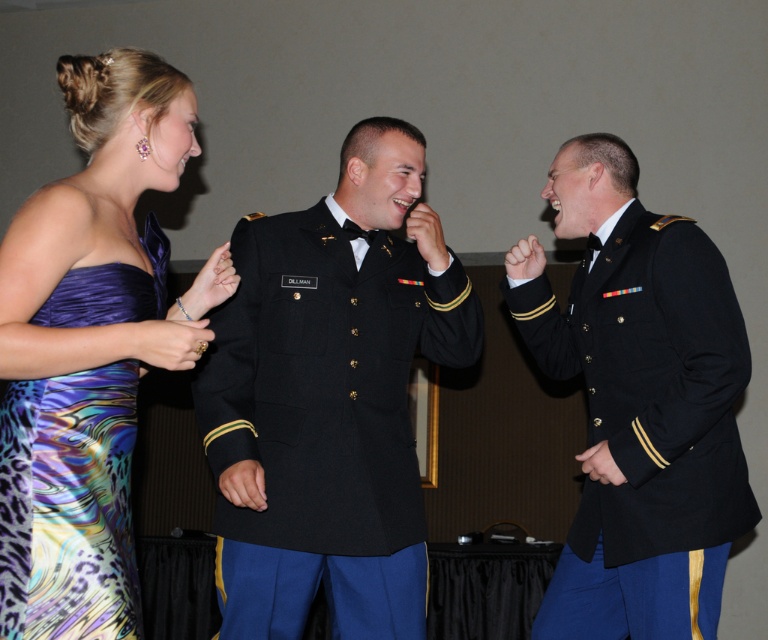
Question: Does black wool military uniform at center appear on the right side of matte black uniform at center?

Choices:
 (A) yes
 (B) no

Answer: (B)

Question: Among these points, which one is farthest from the camera?

Choices:
 (A) (376, 525)
 (B) (51, 477)

Answer: (A)

Question: Can you confirm if black wool military uniform at center is positioned to the right of matte black uniform at center?

Choices:
 (A) yes
 (B) no

Answer: (B)

Question: Is black wool military uniform at center positioned at the back of multicolored satin dress at left?

Choices:
 (A) no
 (B) yes

Answer: (B)

Question: Which of the following is the farthest from the observer?

Choices:
 (A) (x=0, y=548)
 (B) (x=164, y=337)

Answer: (B)

Question: Among these objects, which one is nearest to the camera?

Choices:
 (A) shiny satin dress at left
 (B) matte black uniform at center
 (C) black wool military uniform at center

Answer: (A)